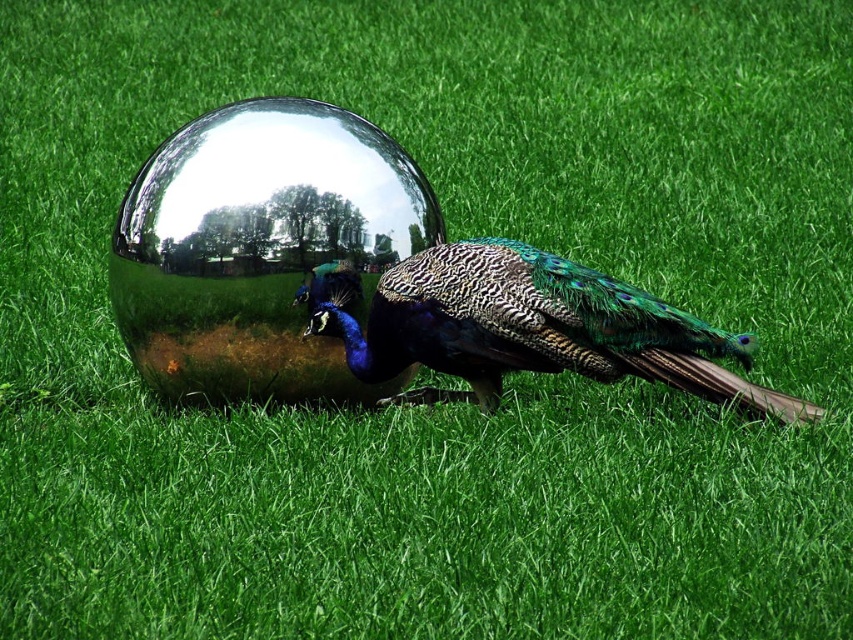
Where is `shiny metallic sphere at center`? The image size is (853, 640). shiny metallic sphere at center is located at coordinates (259, 246).

Does shiny metallic sphere at center appear on the left side of shiny metallic peacock at center?

Indeed, shiny metallic sphere at center is positioned on the left side of shiny metallic peacock at center.

Is shiny metallic sphere at center above shiny metallic peacock at center?

Indeed, shiny metallic sphere at center is positioned over shiny metallic peacock at center.

I want to click on shiny metallic sphere at center, so click(259, 246).

Is shiny metallic peacock at center positioned behind shiny metallic tail at center?

No, shiny metallic peacock at center is closer to the viewer.

Which is above, shiny metallic peacock at center or shiny metallic tail at center?

shiny metallic peacock at center

Locate an element on the screen. shiny metallic peacock at center is located at coordinates (534, 330).